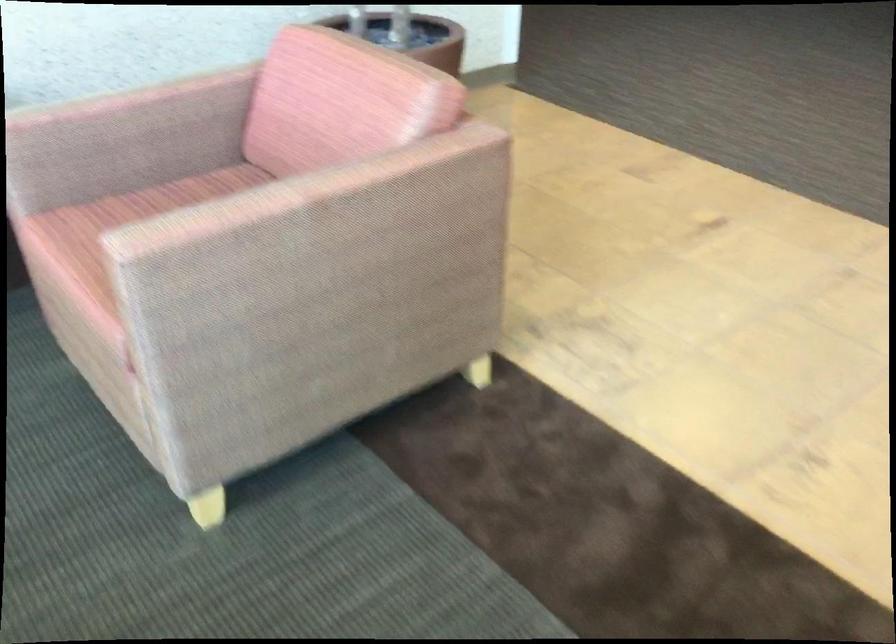
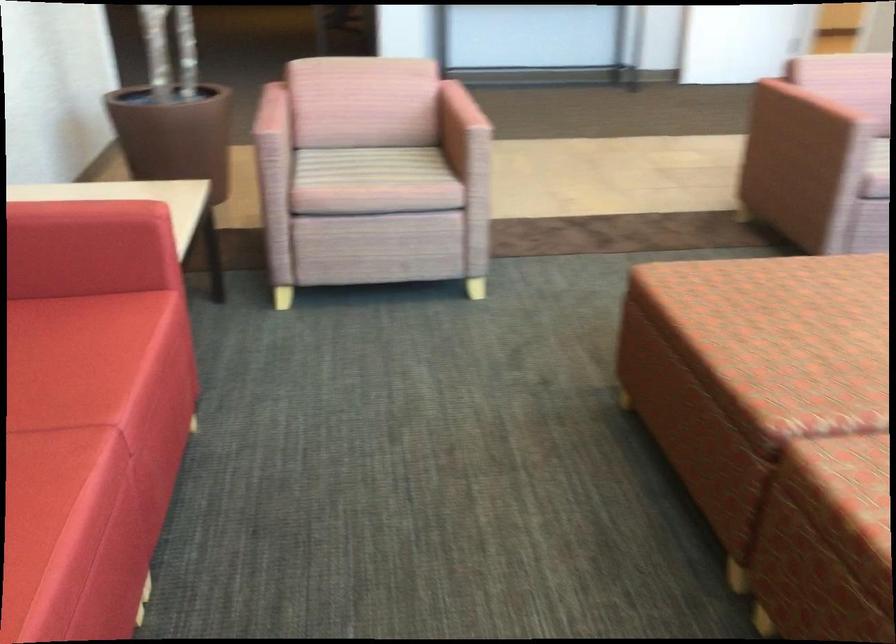
Where in the second image is the point corresponding to [187,222] from the first image?

(459, 118)